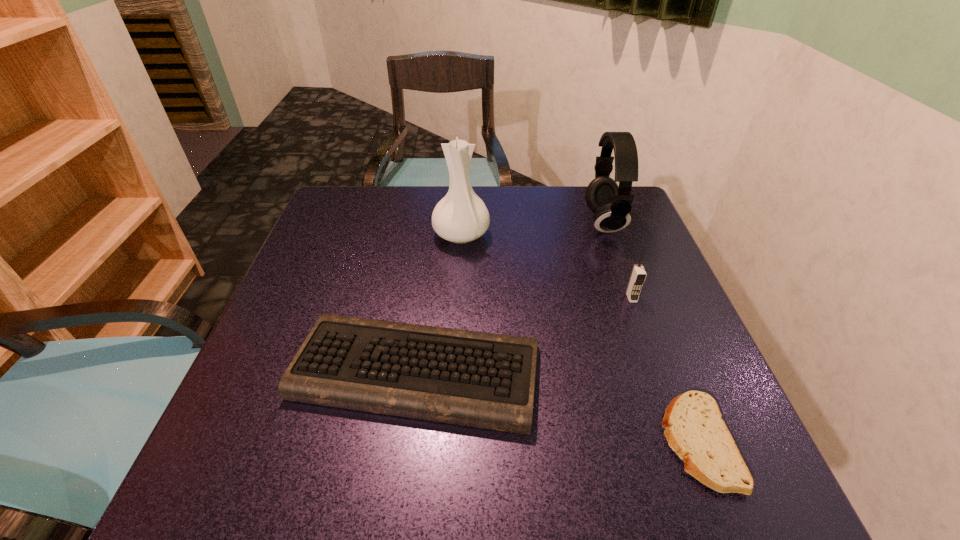
In order to click on object at the far right corner in this screenshot , I will do `click(611, 204)`.

This screenshot has height=540, width=960. In order to click on object that is at the near right corner in this screenshot , I will do `click(695, 431)`.

At what (x,y) coordinates should I click in order to perform the action: click on free region at the far edge. Please return your answer as a coordinate pair (x, y). The width and height of the screenshot is (960, 540). Looking at the image, I should click on (499, 234).

Identify the location of vacant space at the near edge of the desktop. (511, 467).

I want to click on vacant space at the left edge, so click(300, 279).

This screenshot has width=960, height=540. What are the coordinates of `vacant space at the right edge of the desktop` in the screenshot? It's located at (600, 250).

You are a GUI agent. You are given a task and a screenshot of the screen. Output one action in this format:
    pyautogui.click(x=<x>, y=<y>)
    Task: Click on the blank area at the far left corner
    
    Given the screenshot: What is the action you would take?
    pyautogui.click(x=371, y=208)

Where is `vacant space at the far right corner of the desktop`? The image size is (960, 540). vacant space at the far right corner of the desktop is located at coordinates (582, 221).

Identify the location of empty space between the vase and the pita bread. (579, 339).

Find the location of a particular element. The image size is (960, 540). free space that is in between the second shortest object and the pita bread is located at coordinates point(557,407).